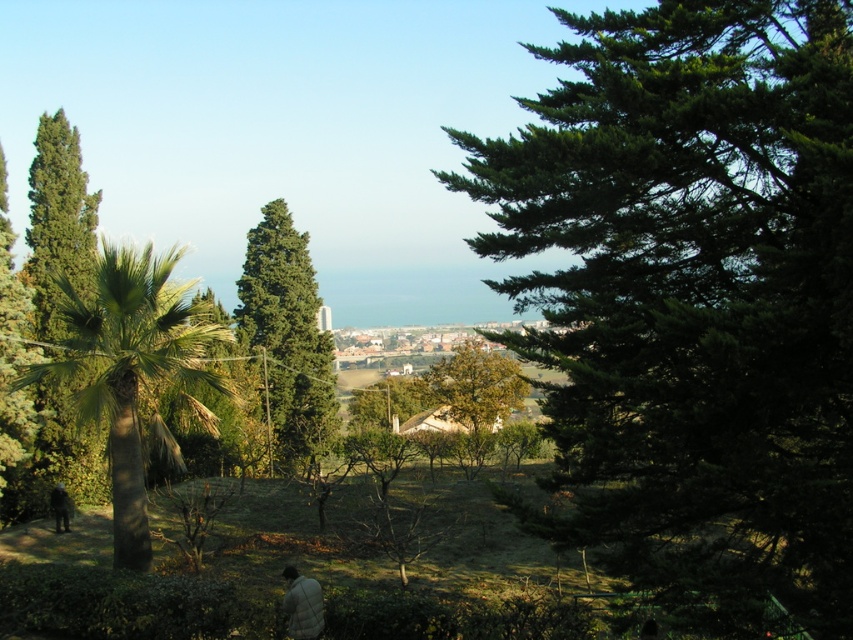
Question: Is green textured tree at center closer to camera compared to dark brown leather jacket at lower center?

Choices:
 (A) yes
 (B) no

Answer: (B)

Question: Among these points, which one is farthest from the camera?

Choices:
 (A) (61, 516)
 (B) (62, 353)
 (C) (526, 387)
 (D) (300, 262)

Answer: (D)

Question: Is white fuzzy jacket at lower center to the right of dark brown leather jacket at lower center from the viewer's perspective?

Choices:
 (A) yes
 (B) no

Answer: (A)

Question: Which point is farther to the camera?

Choices:
 (A) white fuzzy jacket at lower center
 (B) dark brown leather jacket at lower center
 (C) green leafy palm at left

Answer: (B)

Question: Can you confirm if green textured tree at center is smaller than dark brown leather jacket at lower center?

Choices:
 (A) no
 (B) yes

Answer: (A)

Question: Which of the following is the closest to the observer?

Choices:
 (A) dark brown leather jacket at lower center
 (B) brown textured tree at center

Answer: (A)